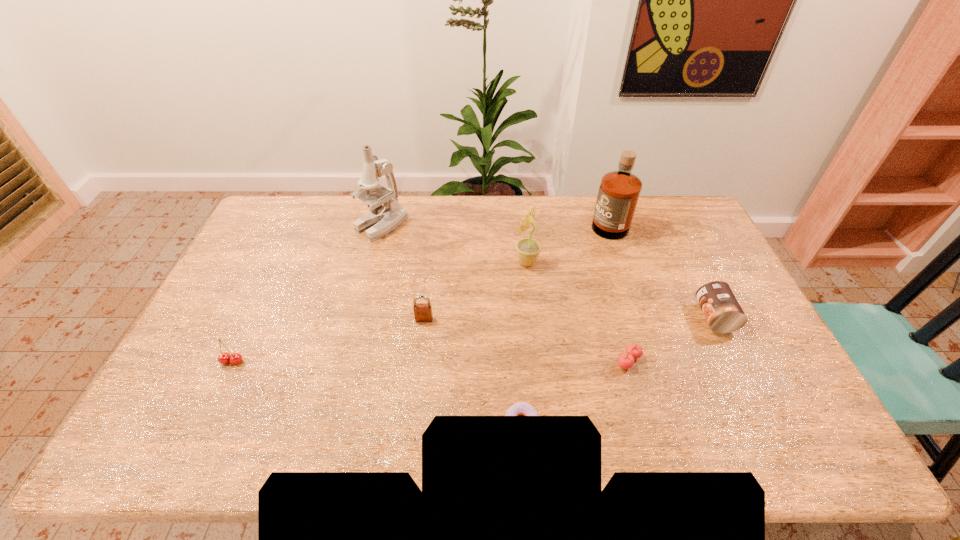
Image resolution: width=960 pixels, height=540 pixels. I want to click on free space between the padlock and the shorter cherry, so click(526, 340).

In order to click on unoccupied position between the seventh tallest object and the sixth object from right to left in this screenshot , I will do `click(526, 340)`.

This screenshot has height=540, width=960. In order to click on blank region between the leftmost object and the liquor in this screenshot , I will do `click(420, 291)`.

At what (x,y) coordinates should I click in order to perform the action: click on vacant space that's between the sunflower and the third object from left to right. Please return your answer as a coordinate pair (x, y). Looking at the image, I should click on (475, 291).

You are a GUI agent. You are given a task and a screenshot of the screen. Output one action in this format:
    pyautogui.click(x=<x>, y=<y>)
    Task: Click on the free space between the sixth shortest object and the can
    
    Given the screenshot: What is the action you would take?
    pyautogui.click(x=620, y=290)

You are a GUI agent. You are given a task and a screenshot of the screen. Output one action in this format:
    pyautogui.click(x=<x>, y=<y>)
    Task: Click on the object that is the seventh nearest to the liquor
    This screenshot has height=540, width=960.
    Given the screenshot: What is the action you would take?
    pyautogui.click(x=224, y=358)

Choose which object is the fifth nearest neighbor to the doughnut. Please provide its 2D coordinates. Your answer should be formatted as a tuple, i.e. [(x, y)], where the tuple contains the x and y coordinates of a point satisfying the conditions above.

[(619, 191)]

Identify the location of free spot that satisfies the following two spatial constraints: 1. on the face of the sixth shortest object; 2. with the stems of the leftmost object pointing upwards. (538, 361).

Locate an element on the screen. This screenshot has width=960, height=540. vacant area in the image that satisfies the following two spatial constraints: 1. on the front label of the liquor; 2. on the front-facing side of the third object from left to right is located at coordinates (640, 319).